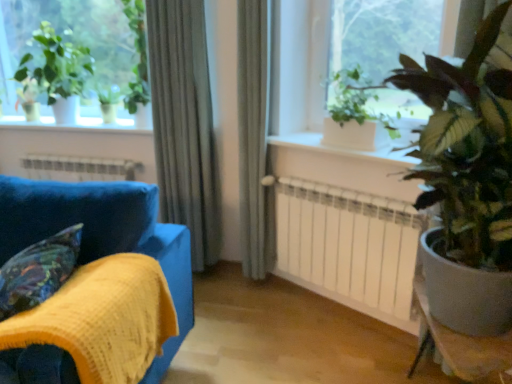
Identify the location of vacant area that is in front of satin fabric curtain at center, the 2th curtain in the left-to-right sequence. (253, 309).